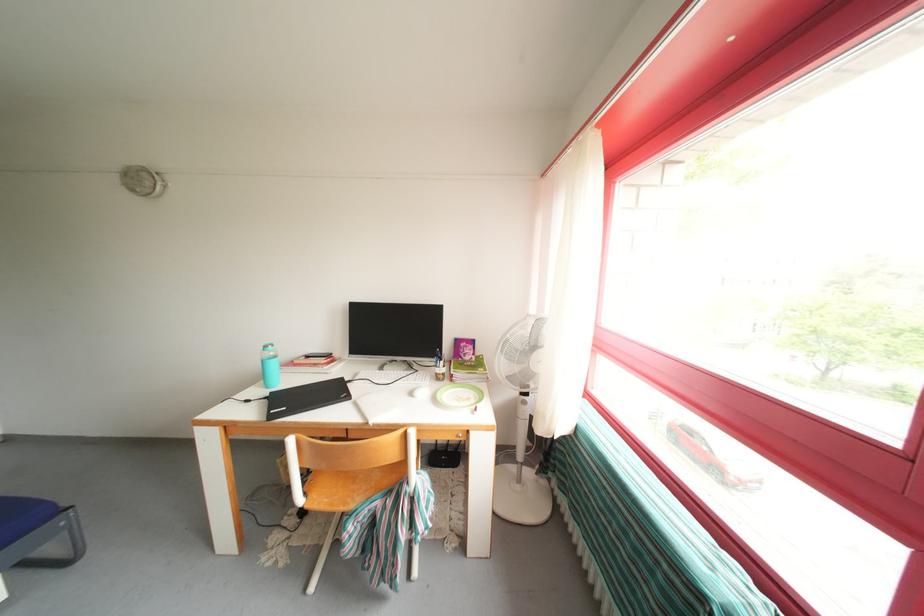
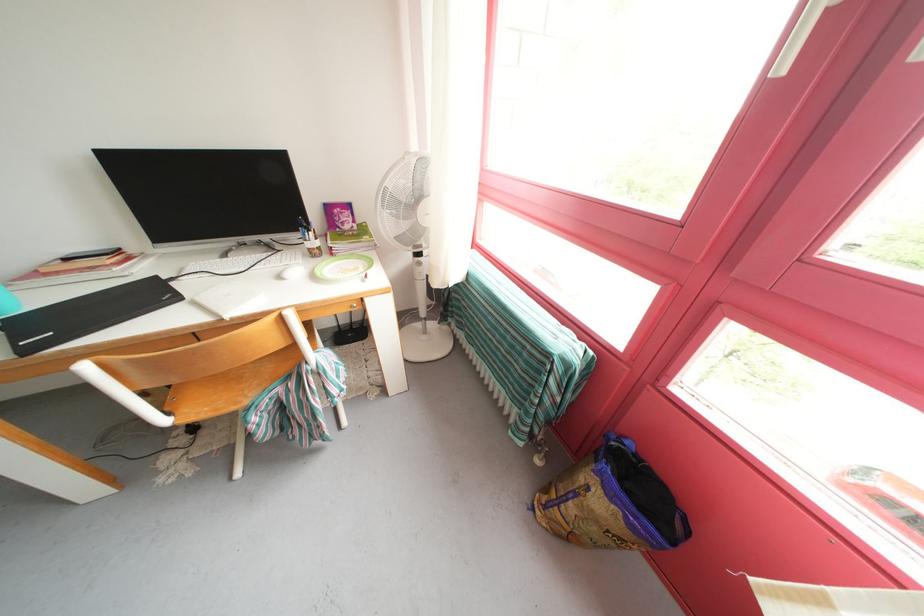
Find the pixel in the second image that matches (448,365) in the first image.

(315, 236)